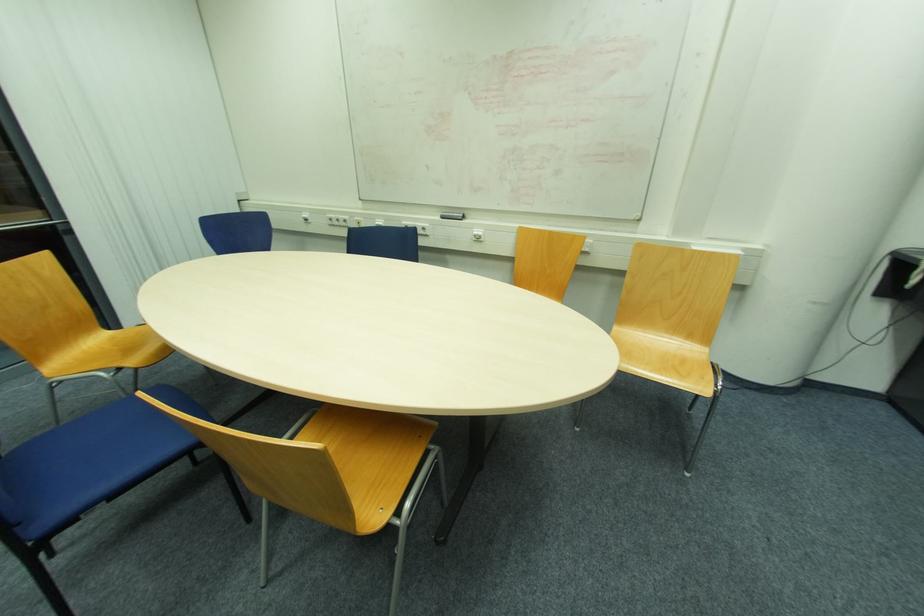
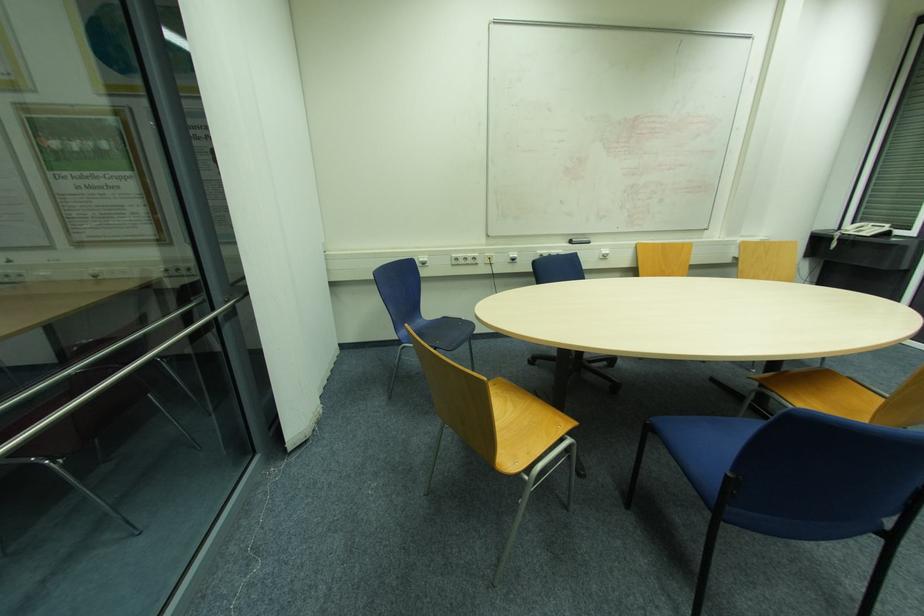
The point at (x=477, y=233) is marked in the first image. Where is the corresponding point in the second image?

(604, 253)